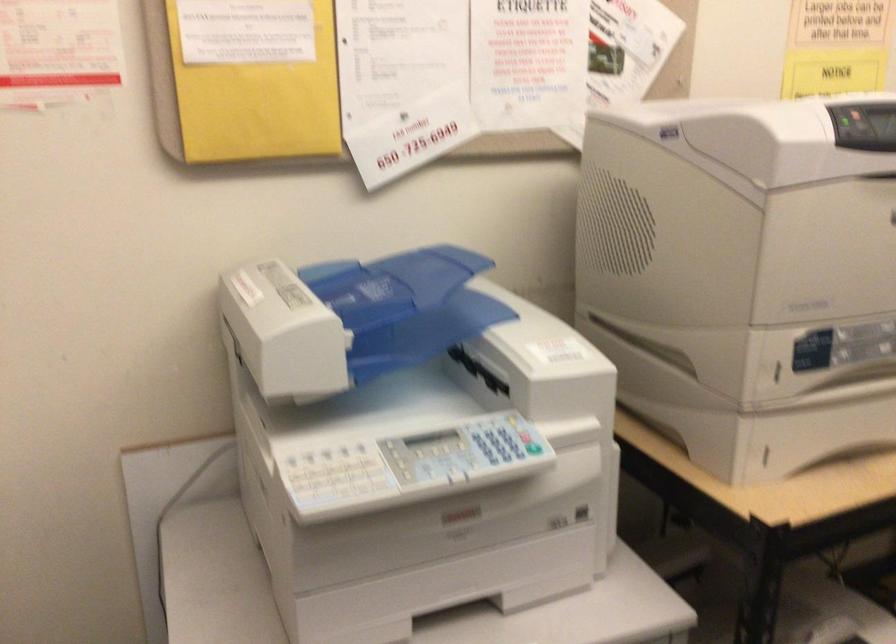
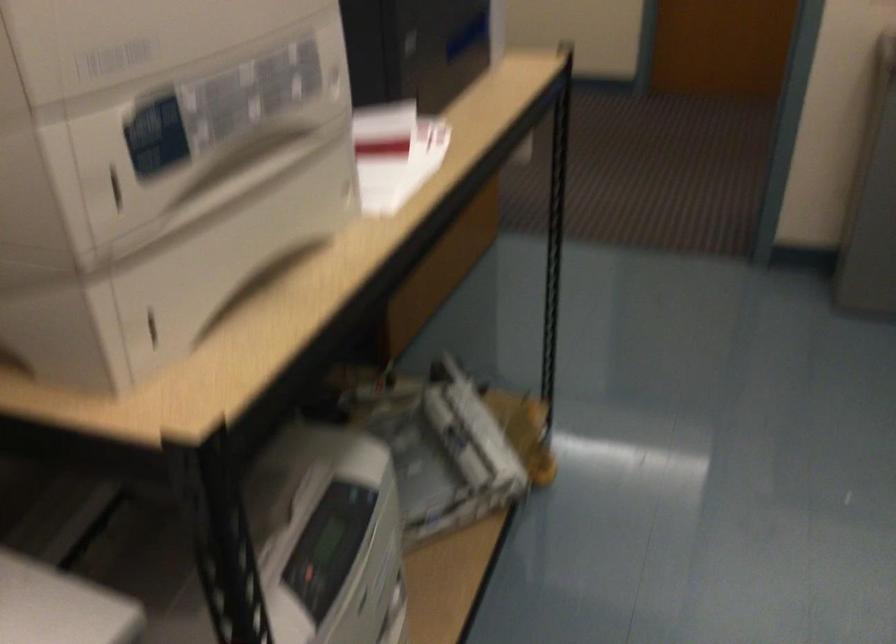
Where in the second image is the point corresponding to point (762, 456) from the first image?

(151, 327)